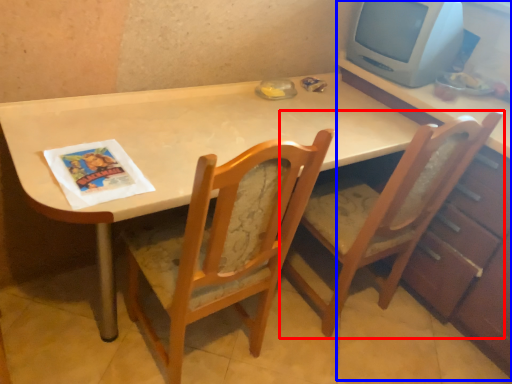
Question: Which of the following is the closest to the observer, chair (highlighted by a red box) or dresser (highlighted by a blue box)?

Choices:
 (A) chair
 (B) dresser

Answer: (A)